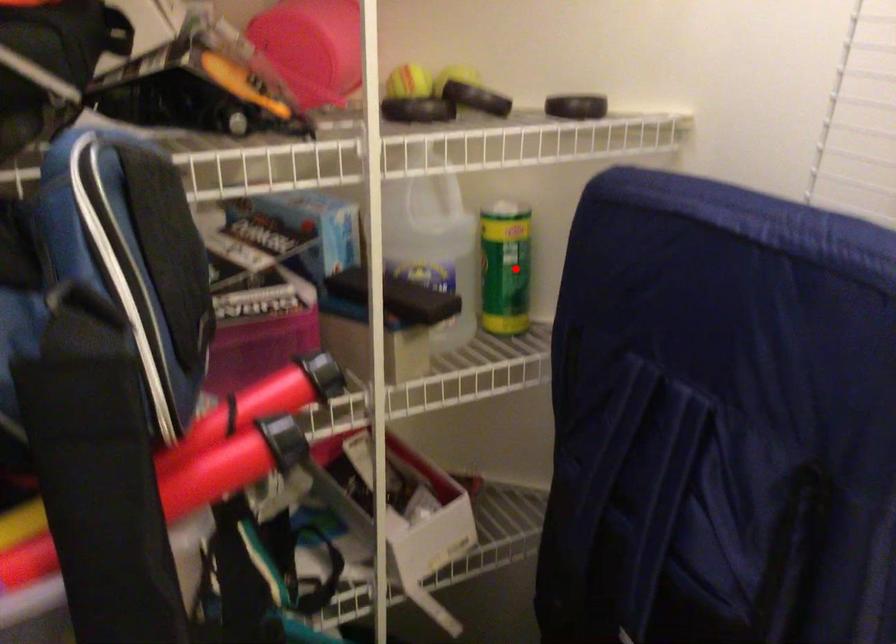
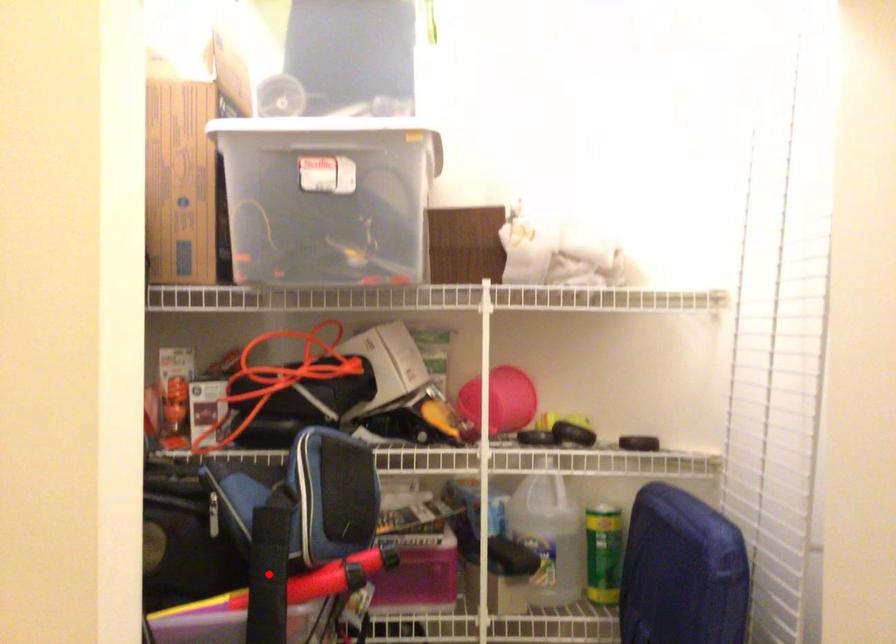
I am providing you with two images of the same scene from different viewpoints. A red point is marked on the first image and another point is marked on the second image. Are the points marked in image1 and image2 representing the same 3D position?

A: No